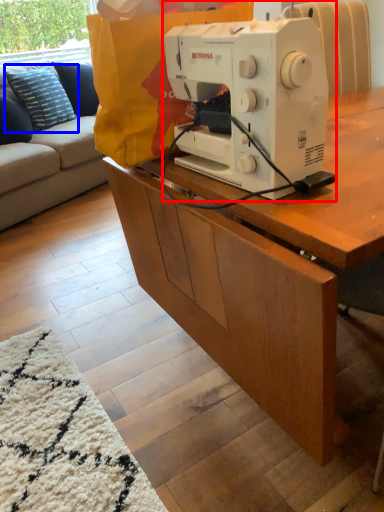
Question: Which point is closer to the camera, sewing machine (highlighted by a red box) or pillow (highlighted by a blue box)?

Choices:
 (A) sewing machine
 (B) pillow

Answer: (A)